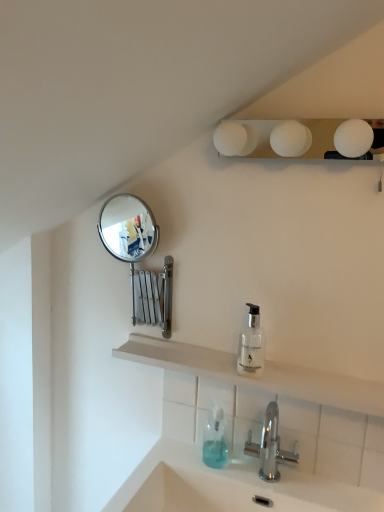
Where is `vacant space in front of translucent plastic soap dispenser at lower center, placed as the first soap dispenser when sorted from bottom to top`? vacant space in front of translucent plastic soap dispenser at lower center, placed as the first soap dispenser when sorted from bottom to top is located at coordinates (231, 479).